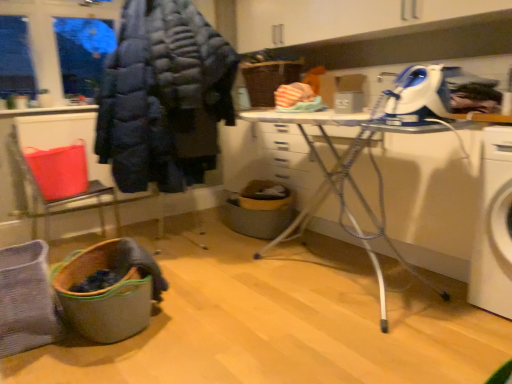
Question: From a real-world perspective, is white plastic ironing board at center on dark blue puffer jacket at upper left?

Choices:
 (A) yes
 (B) no

Answer: (B)

Question: From the image's perspective, is white plastic ironing board at center over dark blue puffer jacket at upper left?

Choices:
 (A) no
 (B) yes

Answer: (A)

Question: From the image's perspective, is white plastic ironing board at center located beneath dark blue puffer jacket at upper left?

Choices:
 (A) no
 (B) yes

Answer: (B)

Question: From a real-world perspective, is white plastic ironing board at center under dark blue puffer jacket at upper left?

Choices:
 (A) yes
 (B) no

Answer: (A)

Question: Is white plastic ironing board at center at the right side of dark blue puffer jacket at upper left?

Choices:
 (A) no
 (B) yes

Answer: (B)

Question: Considering the positions of blue plastic iron at upper right and wooden laundry basket at lower left in the image, is blue plastic iron at upper right bigger or smaller than wooden laundry basket at lower left?

Choices:
 (A) small
 (B) big

Answer: (A)

Question: Visually, is blue plastic iron at upper right positioned to the left or to the right of wooden laundry basket at lower left?

Choices:
 (A) right
 (B) left

Answer: (A)

Question: Is point (404, 114) closer or farther from the camera than point (121, 312)?

Choices:
 (A) farther
 (B) closer

Answer: (B)

Question: Is blue plastic iron at upper right spatially inside wooden laundry basket at lower left, or outside of it?

Choices:
 (A) outside
 (B) inside

Answer: (A)

Question: Is wooden laundry basket at lower left bigger or smaller than brown woven basket at center?

Choices:
 (A) big
 (B) small

Answer: (B)

Question: Relative to brown woven basket at center, is wooden laundry basket at lower left in front or behind?

Choices:
 (A) front
 (B) behind

Answer: (A)

Question: From the image's perspective, is wooden laundry basket at lower left located above or below brown woven basket at center?

Choices:
 (A) below
 (B) above

Answer: (A)

Question: Does point (114, 334) appear closer or farther from the camera than point (256, 86)?

Choices:
 (A) closer
 (B) farther

Answer: (A)

Question: From a real-world perspective, is white plastic ironing board at center physically located above or below brown woven basket at center?

Choices:
 (A) above
 (B) below

Answer: (B)

Question: In the image, is white plastic ironing board at center on the left side or the right side of brown woven basket at center?

Choices:
 (A) left
 (B) right

Answer: (B)